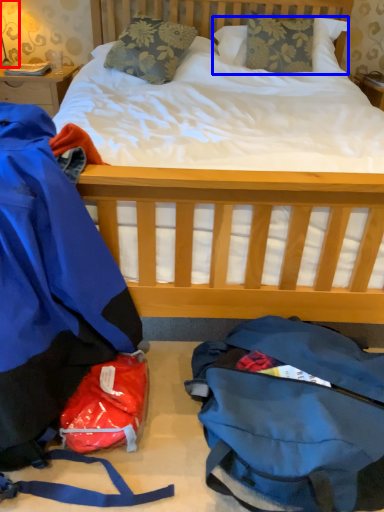
Question: Among these objects, which one is farthest to the camera, lamp (highlighted by a red box) or pillow (highlighted by a blue box)?

Choices:
 (A) lamp
 (B) pillow

Answer: (A)